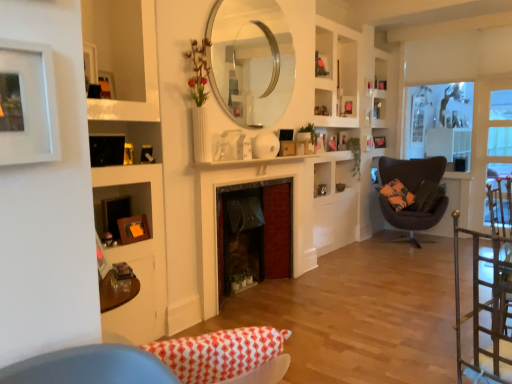
What is the approximate height of clear glass mirror at upper center?

clear glass mirror at upper center is 3.83 feet in height.

Find the location of a particular element. The width and height of the screenshot is (512, 384). clear glass mirror at upper center is located at coordinates (251, 60).

Describe the element at coordinates (347, 106) in the screenshot. Image resolution: width=512 pixels, height=384 pixels. I see `matte black picture frame at upper right, placed as the seventh picture frame when sorted from left to right` at that location.

Find the location of `brick fireplace at center`. brick fireplace at center is located at coordinates 254,232.

Image resolution: width=512 pixels, height=384 pixels. What do you see at coordinates (336, 79) in the screenshot?
I see `transparent glass shelves at upper center` at bounding box center [336, 79].

This screenshot has height=384, width=512. Identify the location of dark gray fabric pillow at right. (426, 197).

Is wooden picture frame at center, the 5th picture frame positioned from the left, far away from wooden picture frame at upper right, which is counted as the seventh picture frame, starting from the bottom?

Yes, wooden picture frame at center, the 5th picture frame positioned from the left, is far from wooden picture frame at upper right, which is counted as the seventh picture frame, starting from the bottom.

Does wooden picture frame at center, acting as the fourth picture frame starting from the right, have a greater width compared to wooden picture frame at upper right, arranged as the first picture frame when viewed from the back?

Indeed, wooden picture frame at center, acting as the fourth picture frame starting from the right, has a greater width compared to wooden picture frame at upper right, arranged as the first picture frame when viewed from the back.

Between wooden picture frame at center, the 4th picture frame when ordered from back to front, and wooden picture frame at upper right, arranged as the 2th picture frame when viewed from the top, which one appears on the right side from the viewer's perspective?

wooden picture frame at upper right, arranged as the 2th picture frame when viewed from the top.

From the image's perspective, which one is positioned higher, velvet dark brown chair at right, acting as the 1th chair starting from the back, or metallic gold chair at right, acting as the second chair starting from the right?

velvet dark brown chair at right, acting as the 1th chair starting from the back, is shown above in the image.

From a real-world perspective, relative to metallic gold chair at right, which is the 1th chair in front-to-back order, is velvet dark brown chair at right, the first chair viewed from the right, vertically above or below?

Answer: velvet dark brown chair at right, the first chair viewed from the right, is situated lower than metallic gold chair at right, which is the 1th chair in front-to-back order, in the real world.

Is velvet dark brown chair at right, acting as the 1th chair starting from the back, touching metallic gold chair at right, which appears as the 1th chair when viewed from the left?

No, velvet dark brown chair at right, acting as the 1th chair starting from the back, is not in contact with metallic gold chair at right, which appears as the 1th chair when viewed from the left.

Does velvet dark brown chair at right, which is the 2th chair from left to right, contain metallic gold chair at right, acting as the 2th chair starting from the back?

Definitely not — metallic gold chair at right, acting as the 2th chair starting from the back, is not inside velvet dark brown chair at right, which is the 2th chair from left to right.

Based on the photo, does clear glass mirror at upper center have a greater height compared to velvet dark brown chair at right, acting as the 2th chair starting from the front?

Correct, clear glass mirror at upper center is much taller as velvet dark brown chair at right, acting as the 2th chair starting from the front.

From a real-world perspective, is clear glass mirror at upper center located beneath velvet dark brown chair at right, acting as the 2th chair starting from the front?

Incorrect, from a real-world perspective, clear glass mirror at upper center is higher than velvet dark brown chair at right, acting as the 2th chair starting from the front.

Who is bigger, clear glass mirror at upper center or velvet dark brown chair at right, acting as the 2th chair starting from the front?

With larger size is velvet dark brown chair at right, acting as the 2th chair starting from the front.

Visually, is clear glass mirror at upper center positioned to the left or to the right of velvet dark brown chair at right, acting as the 2th chair starting from the front?

Based on their positions, clear glass mirror at upper center is located to the left of velvet dark brown chair at right, acting as the 2th chair starting from the front.

Which object is thinner, clear glass window screen at right or matte black picture frame at upper right, which ranks as the sixth picture frame in bottom-to-top order?

Thinner between the two is matte black picture frame at upper right, which ranks as the sixth picture frame in bottom-to-top order.

Is clear glass window screen at right aimed at matte black picture frame at upper right, which is the 2th picture frame in right-to-left order?

No, clear glass window screen at right does not turn towards matte black picture frame at upper right, which is the 2th picture frame in right-to-left order.

From the image's perspective, is clear glass window screen at right under matte black picture frame at upper right, acting as the third picture frame starting from the top?

Indeed, from the image's perspective, clear glass window screen at right is shown beneath matte black picture frame at upper right, acting as the third picture frame starting from the top.

How different are the orientations of clear glass window screen at right and matte black picture frame at upper right, placed as the seventh picture frame when sorted from left to right, in degrees?

The facing directions of clear glass window screen at right and matte black picture frame at upper right, placed as the seventh picture frame when sorted from left to right, are 59.8 degrees apart.

From the image's perspective, does orange matte picture frame at lower left, marked as the 1th picture frame in a left-to-right arrangement, appear lower than wooden picture frame at upper center, marked as the 4th picture frame in a top-to-bottom arrangement?

Yes.

Between orange matte picture frame at lower left, the first picture frame in the bottom-to-top sequence, and wooden picture frame at upper center, placed as the second picture frame when sorted from back to front, which one has less height?

orange matte picture frame at lower left, the first picture frame in the bottom-to-top sequence.

Could you tell me if orange matte picture frame at lower left, which is the 2th picture frame from front to back, is turned towards wooden picture frame at upper center, marked as the 4th picture frame in a top-to-bottom arrangement?

No, orange matte picture frame at lower left, which is the 2th picture frame from front to back, is not turned towards wooden picture frame at upper center, marked as the 4th picture frame in a top-to-bottom arrangement.

Is white matte picture frame at upper left, which is the seventh picture frame from top to bottom, not within metallic gold chair at right, which is the 1th chair in front-to-back order?

Yes, white matte picture frame at upper left, which is the seventh picture frame from top to bottom, is outside of metallic gold chair at right, which is the 1th chair in front-to-back order.

How many degrees apart are the facing directions of white matte picture frame at upper left, the second picture frame when ordered from bottom to top, and metallic gold chair at right, which appears as the 1th chair when viewed from the left?

165 degrees separate the facing orientations of white matte picture frame at upper left, the second picture frame when ordered from bottom to top, and metallic gold chair at right, which appears as the 1th chair when viewed from the left.

The image size is (512, 384). I want to click on picture frame in front of the metallic gold chair at right, acting as the second chair starting from the right, so click(x=27, y=104).

Is clear glass mirror at upper center with wooden picture frame at upper right, which is counted as the seventh picture frame, starting from the bottom?

They are not placed beside each other.

From the picture: Which is more to the right, clear glass mirror at upper center or wooden picture frame at upper right, the eighth picture frame viewed from the front?

wooden picture frame at upper right, the eighth picture frame viewed from the front, is more to the right.

Consider the image. Considering their positions, is clear glass mirror at upper center located in front of or behind wooden picture frame at upper right, acting as the 8th picture frame starting from the left?

Clearly, clear glass mirror at upper center is in front of wooden picture frame at upper right, acting as the 8th picture frame starting from the left.

From the image's perspective, starting from the wooden picture frame at upper right, arranged as the 2th picture frame when viewed from the top, which picture frame is the 3rd one below? Please provide its 2D coordinates.

[(332, 143)]

Locate an element on the screen. chair below the metallic gold chair at right, acting as the 2th chair starting from the back (from a real-world perspective) is located at coordinates (412, 171).

Which object lies further to the anchor point matte black picture frame at upper right, which ranks as the sixth picture frame in bottom-to-top order, wooden picture frame at upper center, the first picture frame when ordered from top to bottom, or dark gray fabric pillow at right?

dark gray fabric pillow at right is further to matte black picture frame at upper right, which ranks as the sixth picture frame in bottom-to-top order.

From the image, which object appears to be farther from clear glass window screen at right, transparent glass shelves at upper center or white matte picture frame at upper left, which is the seventh picture frame from top to bottom?

white matte picture frame at upper left, which is the seventh picture frame from top to bottom, lies further to clear glass window screen at right than the other object.

Based on the photo, when comparing their distances from dark gray fabric pillow at right, does white matte picture frame at upper left, the second picture frame when ordered from bottom to top, or wooden picture frame at upper center, placed as the second picture frame when sorted from back to front, seem further?

white matte picture frame at upper left, the second picture frame when ordered from bottom to top, lies further to dark gray fabric pillow at right than the other object.

Which object lies further to the anchor point wooden picture frame at upper center, marked as the fifth picture frame in a back-to-front arrangement, metallic gold chair at right, which appears as the 1th chair when viewed from the left, or brick fireplace at center?

Among the two, metallic gold chair at right, which appears as the 1th chair when viewed from the left, is located further to wooden picture frame at upper center, marked as the fifth picture frame in a back-to-front arrangement.

Estimate the real-world distances between objects in this image. Which object is further from dark gray fabric pillow at right, velvet dark brown chair at right, the first chair viewed from the right, or matte black picture frame at upper right, acting as the third picture frame starting from the top?

Among the two, matte black picture frame at upper right, acting as the third picture frame starting from the top, is located further to dark gray fabric pillow at right.

From the image, which object appears to be farther from matte black picture frame at upper right, the third picture frame from the back, wooden picture frame at upper right, acting as the 8th picture frame starting from the left, or metallic gold chair at right, which is the 1th chair in front-to-back order?

Among the two, metallic gold chair at right, which is the 1th chair in front-to-back order, is located further to matte black picture frame at upper right, the third picture frame from the back.

Looking at the image, which one is located closer to wooden picture frame at center, the 3th picture frame positioned from the front, transparent glass shelves at upper center or velvet dark brown chair at right, which is the 2th chair from left to right?

Based on the image, transparent glass shelves at upper center appears to be nearer to wooden picture frame at center, the 3th picture frame positioned from the front.

From the image, which object appears to be farther from white matte picture frame at upper left, positioned as the second picture frame in left-to-right order, clear glass mirror at upper center or matte black picture frame at upper right, which is the 2th picture frame in right-to-left order?

matte black picture frame at upper right, which is the 2th picture frame in right-to-left order, is positioned further to the anchor white matte picture frame at upper left, positioned as the second picture frame in left-to-right order.

At what (x,y) coordinates should I click in order to perform the action: click on mirror between white matte picture frame at upper left, positioned as the second picture frame in left-to-right order, and wooden picture frame at upper center, the first picture frame when ordered from top to bottom, from front to back. Please return your answer as a coordinate pair (x, y). Looking at the image, I should click on (251, 60).

I want to click on pillow between white matte picture frame at upper left, which is the first picture frame from front to back, and wooden picture frame at upper right, the 1th picture frame from the right, along the z-axis, so click(x=426, y=197).

This screenshot has width=512, height=384. I want to click on fireplace between white matte picture frame at upper left, which is the first picture frame from front to back, and wooden picture frame at center, acting as the fourth picture frame starting from the bottom, in the front-back direction, so click(x=254, y=232).

This screenshot has height=384, width=512. In order to click on fireplace located between metallic gold chair at right, which appears as the 1th chair when viewed from the left, and dark gray fabric pillow at right in the depth direction in this screenshot , I will do `click(254, 232)`.